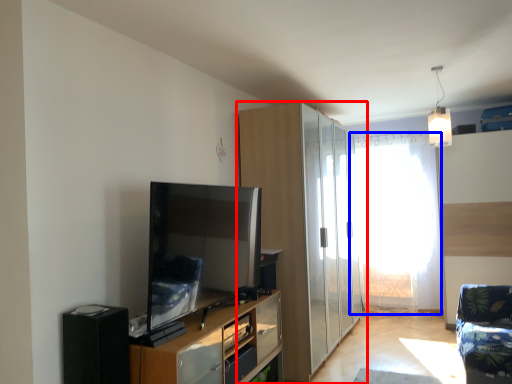
Question: Which of the following is the closest to the observer, cabinetry (highlighted by a red box) or window screen (highlighted by a blue box)?

Choices:
 (A) cabinetry
 (B) window screen

Answer: (A)